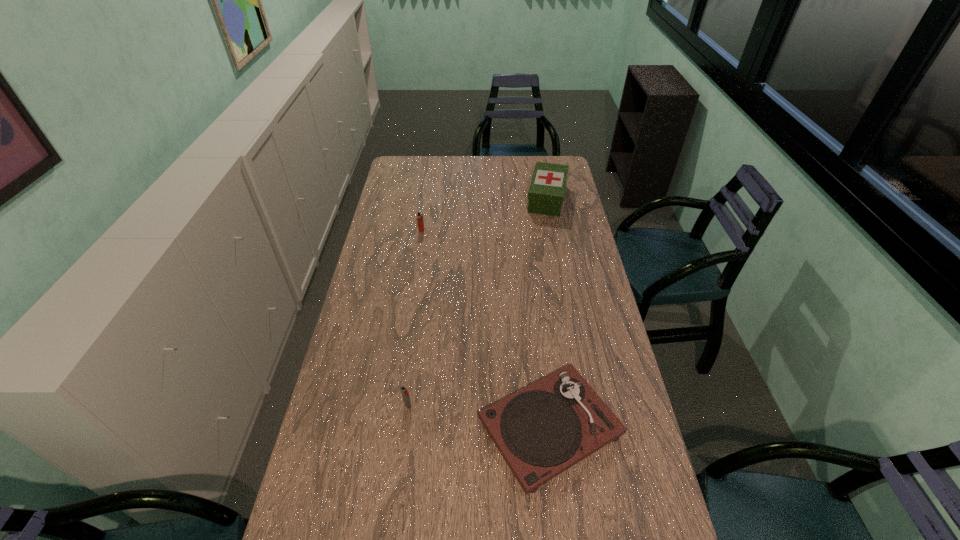
This screenshot has height=540, width=960. I want to click on unoccupied area between the third nearest object and the right igniter, so click(415, 318).

Identify the location of vacant area that lies between the farthest object and the phonograph_record. This screenshot has height=540, width=960. (548, 313).

Point out which object is positioned as the nearest to the third nearest object. Please provide its 2D coordinates. Your answer should be formatted as a tuple, i.e. [(x, y)], where the tuple contains the x and y coordinates of a point satisfying the conditions above.

[(546, 193)]

In order to click on object that is the closest to the farther igniter in this screenshot , I will do coord(546,193).

Identify the location of vacant space that satisfies the following two spatial constraints: 1. on the front side of the right igniter; 2. on the right side of the left igniter. This screenshot has height=540, width=960. (395, 406).

The width and height of the screenshot is (960, 540). Find the location of `free space that satisfies the following two spatial constraints: 1. on the front side of the right igniter; 2. on the left side of the phonograph_record`. free space that satisfies the following two spatial constraints: 1. on the front side of the right igniter; 2. on the left side of the phonograph_record is located at coordinates pos(405,427).

Locate an element on the screen. free space that satisfies the following two spatial constraints: 1. on the back side of the first-aid kit; 2. on the left side of the farther igniter is located at coordinates (426, 199).